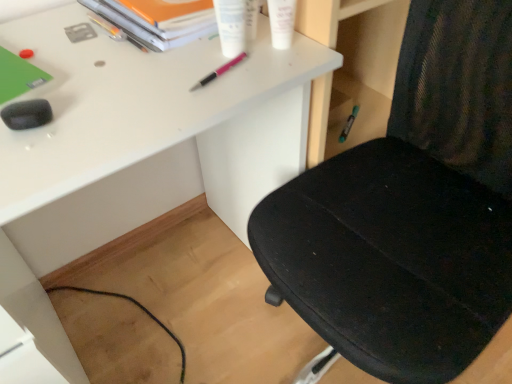
The image size is (512, 384). Find the location of `free area in between white plastic tubes at upper center, which is counted as the third stationery, starting from the right, and metallic silver pen at upper left, the fifth stationery positioned from the front`. free area in between white plastic tubes at upper center, which is counted as the third stationery, starting from the right, and metallic silver pen at upper left, the fifth stationery positioned from the front is located at coordinates (162, 35).